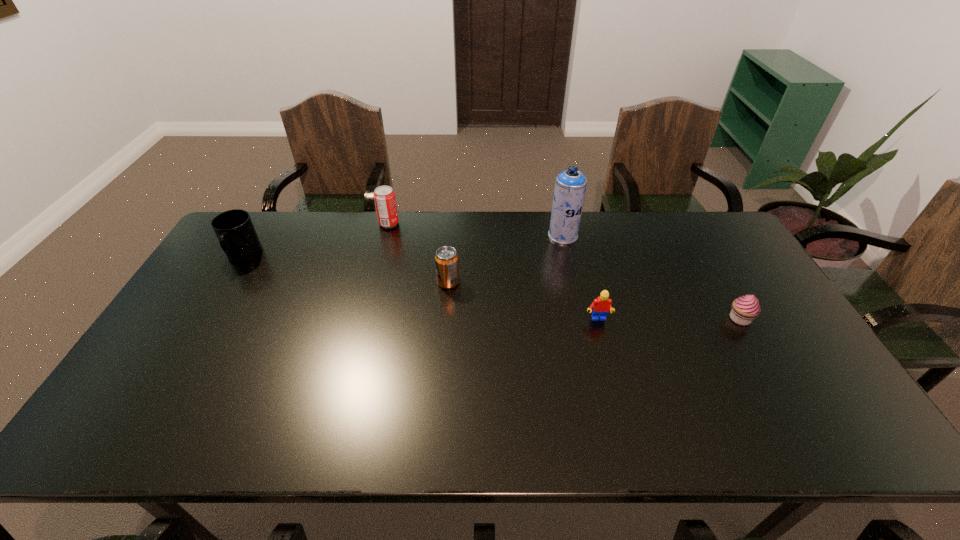
Locate an element on the screen. The image size is (960, 540). free space that is in between the leftmost object and the tallest object is located at coordinates (403, 246).

This screenshot has height=540, width=960. In order to click on free point between the leftmost object and the Lego in this screenshot , I will do `click(420, 288)`.

Locate an element on the screen. free space that is in between the left soda can and the aerosol can is located at coordinates (476, 230).

Image resolution: width=960 pixels, height=540 pixels. In order to click on vacant region between the third object from left to right and the leftmost object in this screenshot , I will do `click(346, 269)`.

The image size is (960, 540). Find the location of `free area in between the left soda can and the mug`. free area in between the left soda can and the mug is located at coordinates (316, 240).

Choose which object is the third nearest neighbor to the leftmost object. Please provide its 2D coordinates. Your answer should be formatted as a tuple, i.e. [(x, y)], where the tuple contains the x and y coordinates of a point satisfying the conditions above.

[(570, 186)]

You are a GUI agent. You are given a task and a screenshot of the screen. Output one action in this format:
    pyautogui.click(x=<x>, y=<y>)
    Task: Click on the object that can be found as the fourth closest to the mug
    
    Given the screenshot: What is the action you would take?
    pyautogui.click(x=602, y=305)

This screenshot has width=960, height=540. Find the location of `blank area in the image that satisfies the following two spatial constraints: 1. on the side of the leftmost object with the handle; 2. on the right side of the cupcake`. blank area in the image that satisfies the following two spatial constraints: 1. on the side of the leftmost object with the handle; 2. on the right side of the cupcake is located at coordinates (205, 319).